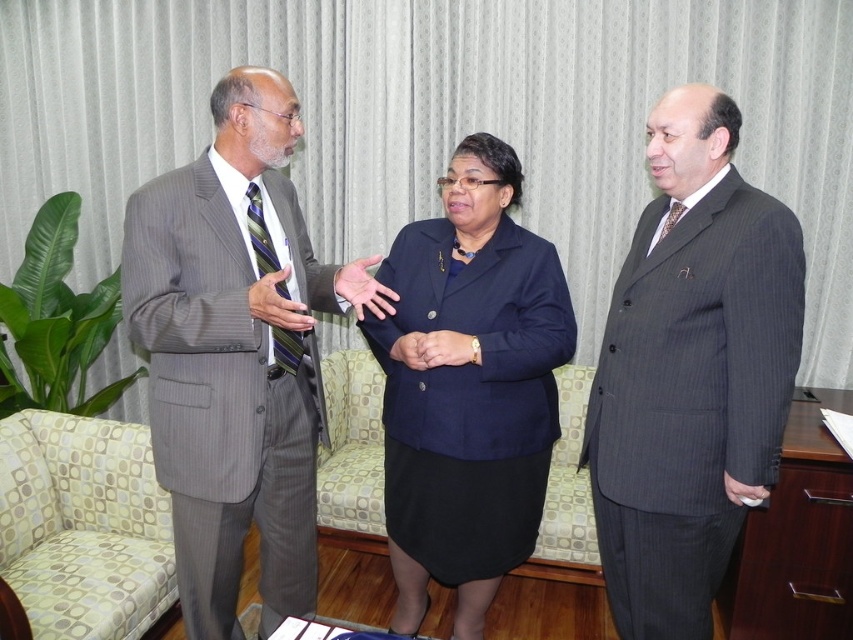
Question: Is the position of gray pinstripe suit at left more distant than that of navy blue fabric skirt at center?

Choices:
 (A) yes
 (B) no

Answer: (B)

Question: Which point is farther to the camera?

Choices:
 (A) (444, 360)
 (B) (730, 228)
 (C) (207, 280)

Answer: (A)

Question: Can you confirm if gray pinstripe suit at right is positioned below yellow-green patterned armchair at center?

Choices:
 (A) no
 (B) yes

Answer: (A)

Question: Is navy blue fabric skirt at center in front of yellow-green patterned armchair at center?

Choices:
 (A) no
 (B) yes

Answer: (A)

Question: Which point is farther from the camera taking this photo?

Choices:
 (A) (689, 420)
 (B) (142, 544)

Answer: (B)

Question: Which point is closer to the camera taking this photo?

Choices:
 (A) pyautogui.click(x=7, y=563)
 (B) pyautogui.click(x=219, y=560)
 (C) pyautogui.click(x=483, y=276)

Answer: (B)